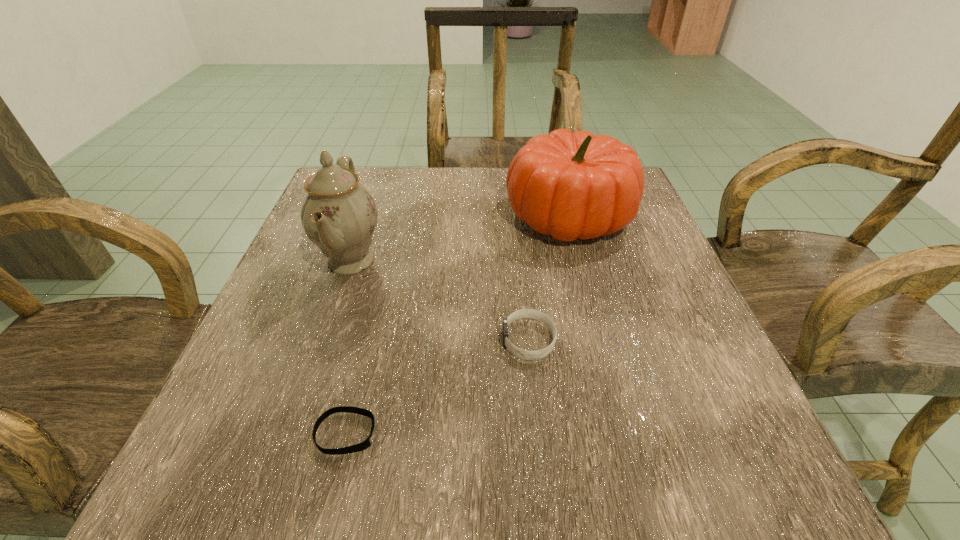
In the image, there is a desktop. What are the coordinates of `vacant area at the left edge` in the screenshot? It's located at (268, 328).

In the image, there is a desktop. Identify the location of vacant space at the right edge. (636, 231).

Identify the location of vacant space at the near left corner of the desktop. The image size is (960, 540). (218, 438).

Identify the location of free space at the near right corner of the desktop. point(713,448).

Locate an element on the screen. The image size is (960, 540). free space between the farther wristband and the shortest object is located at coordinates (438, 387).

Image resolution: width=960 pixels, height=540 pixels. Identify the location of vacant point located between the shortest object and the third tallest object. (x=438, y=387).

You are a GUI agent. You are given a task and a screenshot of the screen. Output one action in this format:
    pyautogui.click(x=<x>, y=<y>)
    Task: Click on the vacant space that is in between the pumpkin and the second shortest object
    The image size is (960, 540).
    Given the screenshot: What is the action you would take?
    pyautogui.click(x=549, y=278)

Image resolution: width=960 pixels, height=540 pixels. I want to click on vacant area between the pumpkin and the shorter wristband, so click(458, 325).

Where is `vacant space that is in between the third shortest object and the third tallest object`? The height and width of the screenshot is (540, 960). vacant space that is in between the third shortest object and the third tallest object is located at coordinates (549, 278).

Where is `unoccupied area between the right wristband and the tallest object`? This screenshot has width=960, height=540. unoccupied area between the right wristband and the tallest object is located at coordinates (440, 300).